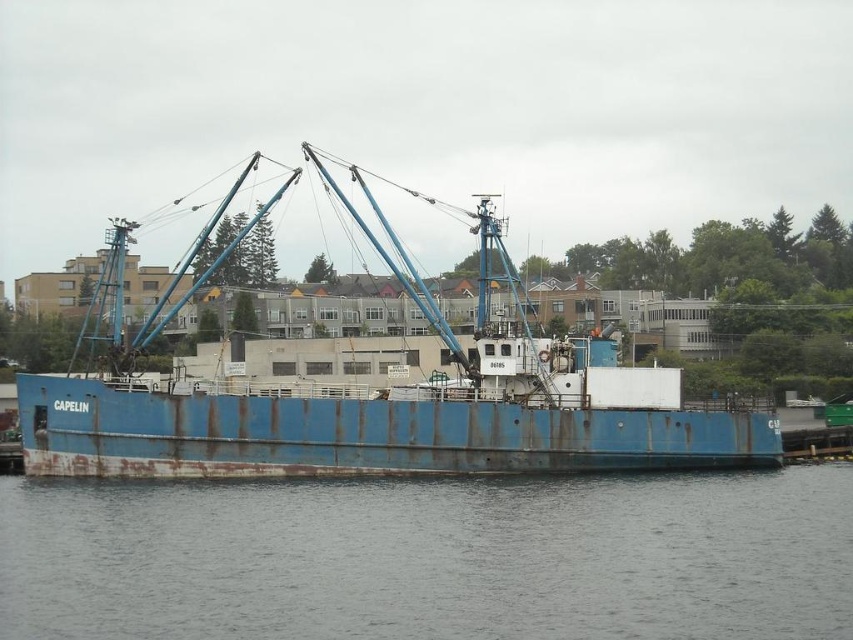
Question: Does gray water at lower center appear under rusty metal boat at center?

Choices:
 (A) yes
 (B) no

Answer: (A)

Question: Which point is closer to the camera?

Choices:
 (A) (100, 504)
 (B) (308, 394)

Answer: (A)

Question: In this image, where is gray water at lower center located relative to rusty metal boat at center?

Choices:
 (A) left
 (B) right

Answer: (B)

Question: Does gray water at lower center appear on the right side of rusty metal boat at center?

Choices:
 (A) no
 (B) yes

Answer: (B)

Question: Among these points, which one is farthest from the camera?

Choices:
 (A) (675, 512)
 (B) (183, 428)

Answer: (B)

Question: Which of the following is the farthest from the observer?

Choices:
 (A) rusty metal boat at center
 (B) gray water at lower center

Answer: (A)